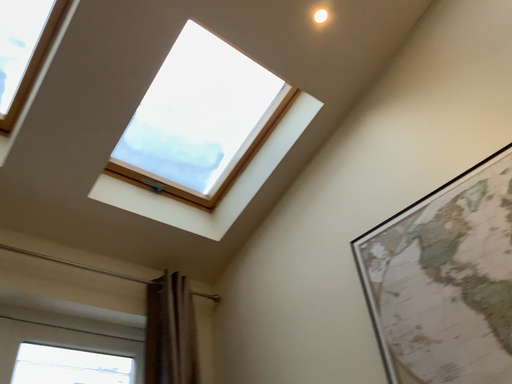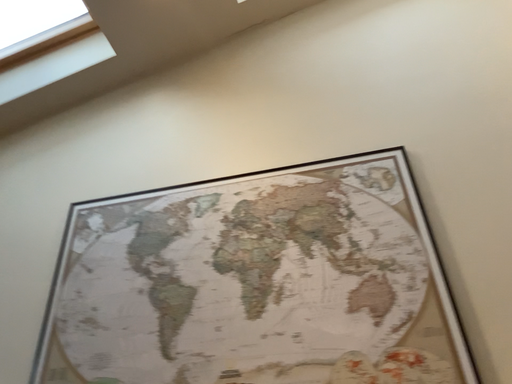
Question: How did the camera likely rotate when shooting the video?

Choices:
 (A) rotated left
 (B) rotated right

Answer: (B)